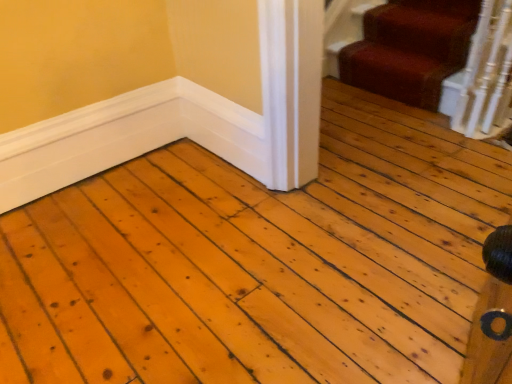
Describe the element at coordinates (410, 49) in the screenshot. Image resolution: width=512 pixels, height=384 pixels. I see `velvet burgundy stairs at upper right` at that location.

Where is `velvet burgundy stairs at upper right`? velvet burgundy stairs at upper right is located at coordinates (410, 49).

Where is `velvet burgundy stairs at upper right`? The image size is (512, 384). velvet burgundy stairs at upper right is located at coordinates (410, 49).